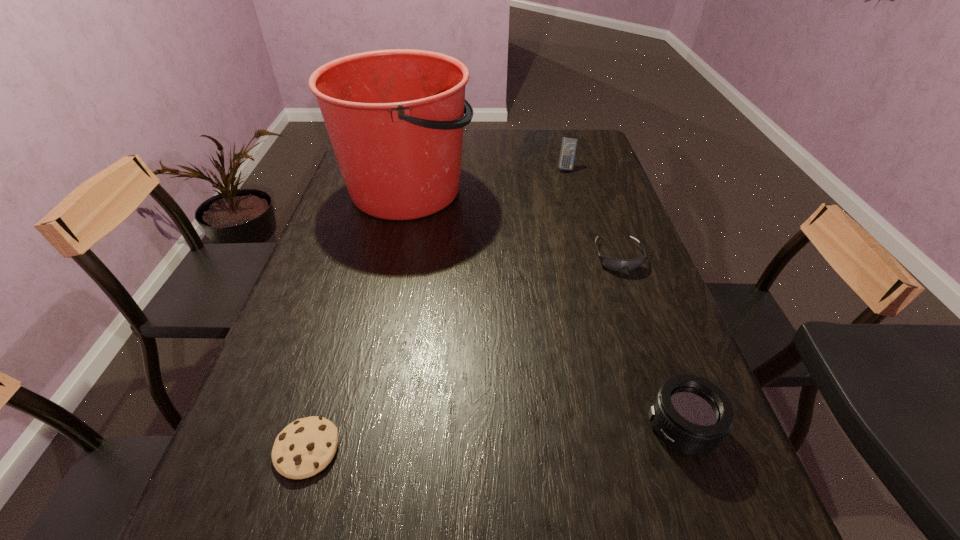
The height and width of the screenshot is (540, 960). Identify the location of bucket. (395, 118).

Find the location of a particular element. the fourth shortest object is located at coordinates pyautogui.click(x=568, y=146).

At what (x,y) coordinates should I click in order to perform the action: click on telephoto lens. Please return your answer as a coordinate pair (x, y). The width and height of the screenshot is (960, 540). Looking at the image, I should click on (692, 415).

Find the location of a particular element. This screenshot has width=960, height=540. goggles is located at coordinates (614, 264).

Where is `cookie`? This screenshot has width=960, height=540. cookie is located at coordinates (305, 447).

Where is `vacant space situated 0.260m on the front of the bucket`? vacant space situated 0.260m on the front of the bucket is located at coordinates (383, 297).

The width and height of the screenshot is (960, 540). Find the location of `free space located 0.240m on the front-facing side of the calculator`. free space located 0.240m on the front-facing side of the calculator is located at coordinates (578, 213).

This screenshot has height=540, width=960. I want to click on free location located 0.350m on the side of the third shortest object with brand markings and control switches, so click(462, 427).

Image resolution: width=960 pixels, height=540 pixels. In order to click on free point located 0.200m on the side of the third shortest object with brand markings and control switches in this screenshot , I will do `click(541, 427)`.

Find the location of a particular element. The height and width of the screenshot is (540, 960). free space located on the side of the third shortest object with brand markings and control switches is located at coordinates (477, 427).